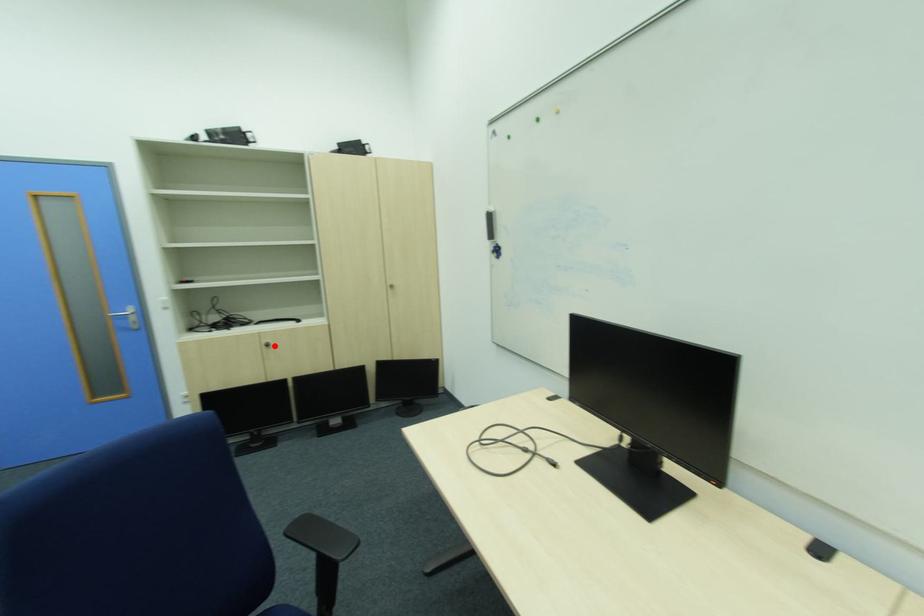
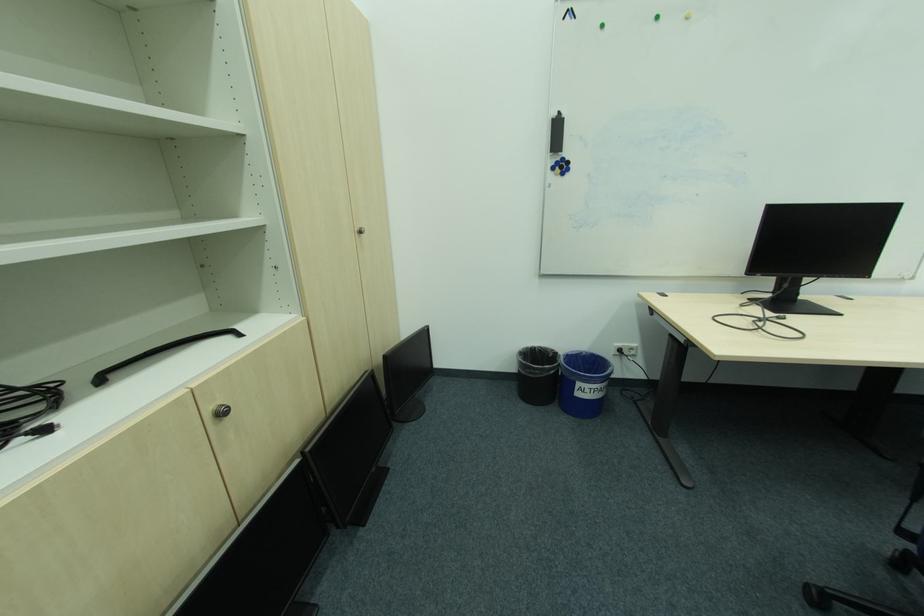
Locate, in the second image, the point that corresponds to the highlighted location in the first image.

(227, 415)